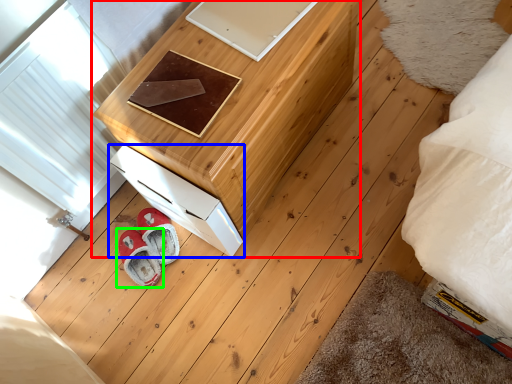
Question: Which object is positioned farthest from furniture (highlighted by a red box)? Select from drawer (highlighted by a blue box) and footwear (highlighted by a green box).

Choices:
 (A) drawer
 (B) footwear

Answer: (B)